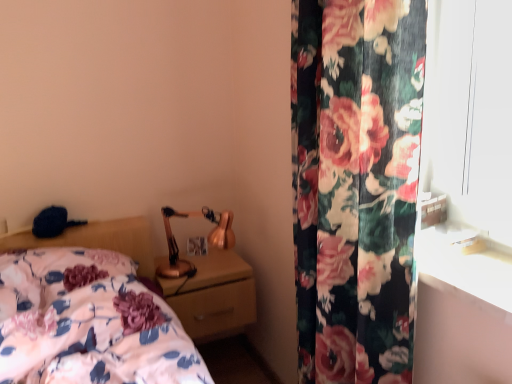
Image resolution: width=512 pixels, height=384 pixels. Find the location of `free space above matte gold nightstand at center (from a real-world perspective)`. free space above matte gold nightstand at center (from a real-world perspective) is located at coordinates (201, 266).